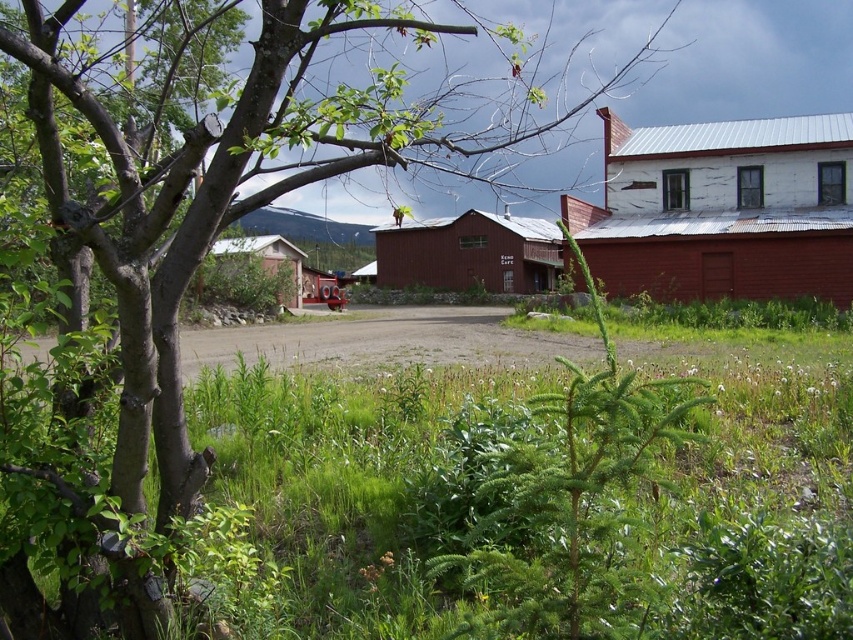
Is green leafy plant at center behind rustic wood barn at center?

No, it is not.

Which is in front, point (579, 573) or point (514, 276)?

Positioned in front is point (579, 573).

Locate an element on the screen. This screenshot has height=640, width=853. green leafy plant at center is located at coordinates (570, 500).

Between rusty corrugated metal barn at right and green leafy plant at center, which one appears on the left side from the viewer's perspective?

green leafy plant at center

Who is lower down, rusty corrugated metal barn at right or green leafy plant at center?

Positioned lower is green leafy plant at center.

Locate an element on the screen. This screenshot has width=853, height=640. rusty corrugated metal barn at right is located at coordinates click(x=722, y=209).

Does rusty corrugated metal barn at right have a larger size compared to rustic wood barn at center?

Indeed, rusty corrugated metal barn at right has a larger size compared to rustic wood barn at center.

Can you confirm if rusty corrugated metal barn at right is positioned to the right of rustic wood barn at center?

Yes, rusty corrugated metal barn at right is to the right of rustic wood barn at center.

This screenshot has height=640, width=853. In order to click on rusty corrugated metal barn at right in this screenshot , I will do coord(722,209).

The image size is (853, 640). I want to click on rusty corrugated metal barn at right, so click(x=722, y=209).